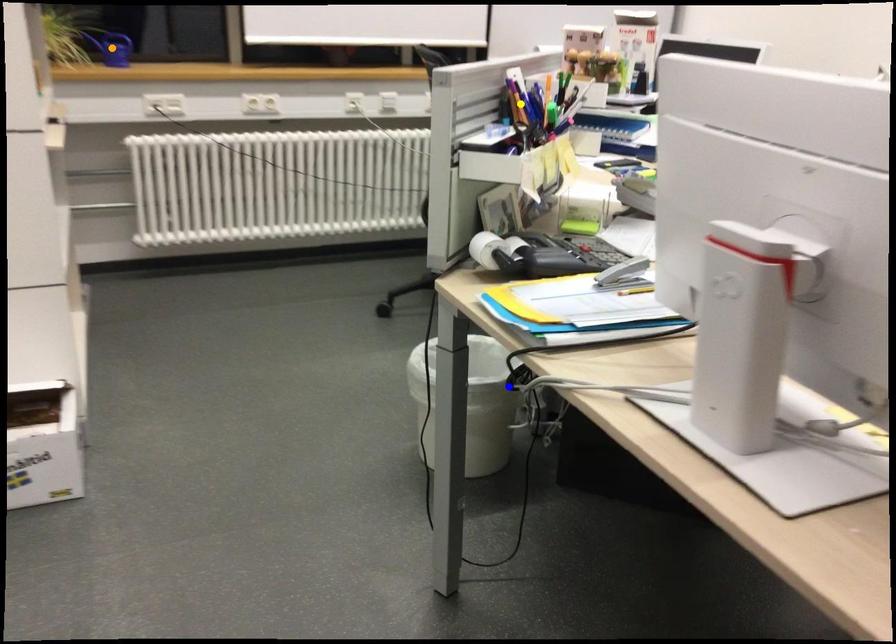
Order these from nearest to farthest:
blue point
orange point
yellow point

blue point, yellow point, orange point